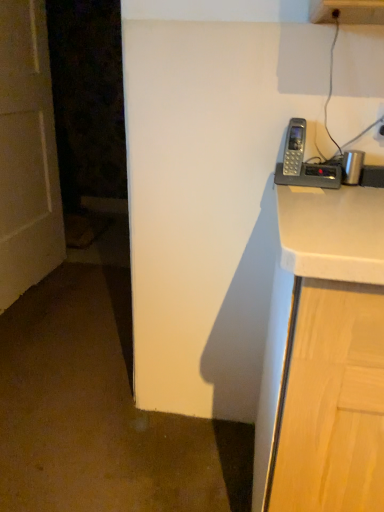
Question: Is gray plastic phone at upper right at the right side of white plastic electric outlet at upper right?

Choices:
 (A) no
 (B) yes

Answer: (A)

Question: From the image's perspective, is gray plastic phone at upper right on white plastic electric outlet at upper right?

Choices:
 (A) yes
 (B) no

Answer: (B)

Question: Is gray plastic phone at upper right outside of white plastic electric outlet at upper right?

Choices:
 (A) yes
 (B) no

Answer: (A)

Question: Is gray plastic phone at upper right further to the viewer compared to white plastic electric outlet at upper right?

Choices:
 (A) no
 (B) yes

Answer: (A)

Question: Can you confirm if gray plastic phone at upper right is taller than white plastic electric outlet at upper right?

Choices:
 (A) no
 (B) yes

Answer: (B)

Question: Is there a large distance between gray plastic phone at upper right and white plastic electric outlet at upper right?

Choices:
 (A) no
 (B) yes

Answer: (A)

Question: Does white plastic electric outlet at upper right have a lesser height compared to white matte door at left?

Choices:
 (A) no
 (B) yes

Answer: (B)

Question: Is white plastic electric outlet at upper right aimed at white matte door at left?

Choices:
 (A) yes
 (B) no

Answer: (B)

Question: Is white plastic electric outlet at upper right closer to camera compared to white matte door at left?

Choices:
 (A) yes
 (B) no

Answer: (A)

Question: From the image's perspective, is white plastic electric outlet at upper right located above white matte door at left?

Choices:
 (A) no
 (B) yes

Answer: (A)

Question: Can we say white plastic electric outlet at upper right lies outside white matte door at left?

Choices:
 (A) yes
 (B) no

Answer: (A)

Question: Does white plastic electric outlet at upper right have a greater width compared to white matte door at left?

Choices:
 (A) no
 (B) yes

Answer: (A)

Question: Is white matte door at left further to the viewer compared to gray plastic phone at upper right?

Choices:
 (A) no
 (B) yes

Answer: (B)